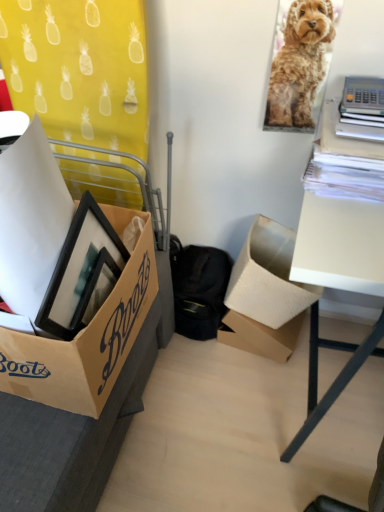
Question: Is white matte table at right positioned far away from golden fur dog at upper right?

Choices:
 (A) no
 (B) yes

Answer: (A)

Question: Does white matte table at right have a greater height compared to golden fur dog at upper right?

Choices:
 (A) yes
 (B) no

Answer: (A)

Question: Does white matte table at right come behind golden fur dog at upper right?

Choices:
 (A) no
 (B) yes

Answer: (A)

Question: Is white matte table at right facing away from golden fur dog at upper right?

Choices:
 (A) no
 (B) yes

Answer: (A)

Question: Does white matte table at right contain golden fur dog at upper right?

Choices:
 (A) yes
 (B) no

Answer: (B)

Question: Considering the relative sizes of white matte table at right and golden fur dog at upper right in the image provided, is white matte table at right thinner than golden fur dog at upper right?

Choices:
 (A) no
 (B) yes

Answer: (A)

Question: Considering the relative sizes of golden fur dog at upper right and white matte table at right in the image provided, is golden fur dog at upper right taller than white matte table at right?

Choices:
 (A) no
 (B) yes

Answer: (A)

Question: Does golden fur dog at upper right have a greater width compared to white matte table at right?

Choices:
 (A) yes
 (B) no

Answer: (B)

Question: From the image's perspective, is golden fur dog at upper right beneath white matte table at right?

Choices:
 (A) yes
 (B) no

Answer: (B)

Question: Is golden fur dog at upper right at the left side of white matte table at right?

Choices:
 (A) no
 (B) yes

Answer: (B)

Question: Would you say golden fur dog at upper right is outside white matte table at right?

Choices:
 (A) no
 (B) yes

Answer: (B)

Question: Is golden fur dog at upper right looking in the opposite direction of white matte table at right?

Choices:
 (A) yes
 (B) no

Answer: (B)

Question: Would you say brown cardboard box at center, arranged as the 2th box when viewed from the right, is part of cardboard box at lower right, the third box viewed from the left,'s contents?

Choices:
 (A) yes
 (B) no

Answer: (B)